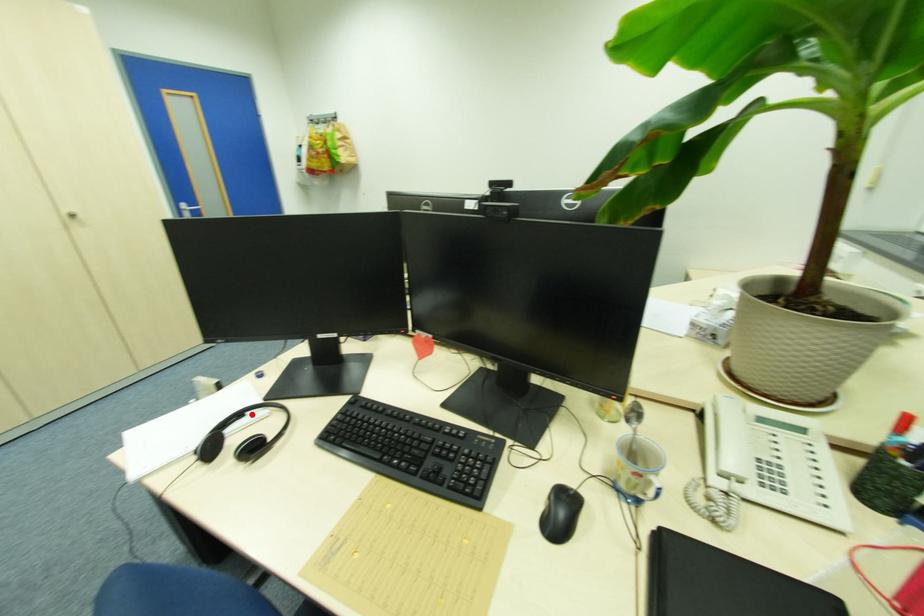
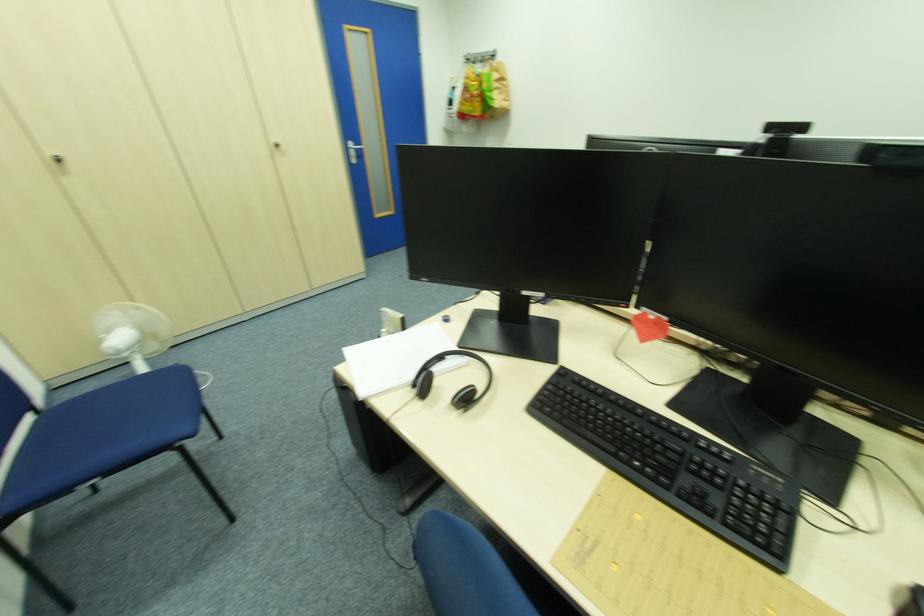
Question: I am providing you with two images of the same scene from different viewpoints. A red point is marked on the first image. Is the red point's position out of view in image 2?

Choices:
 (A) Yes
 (B) No

Answer: (B)